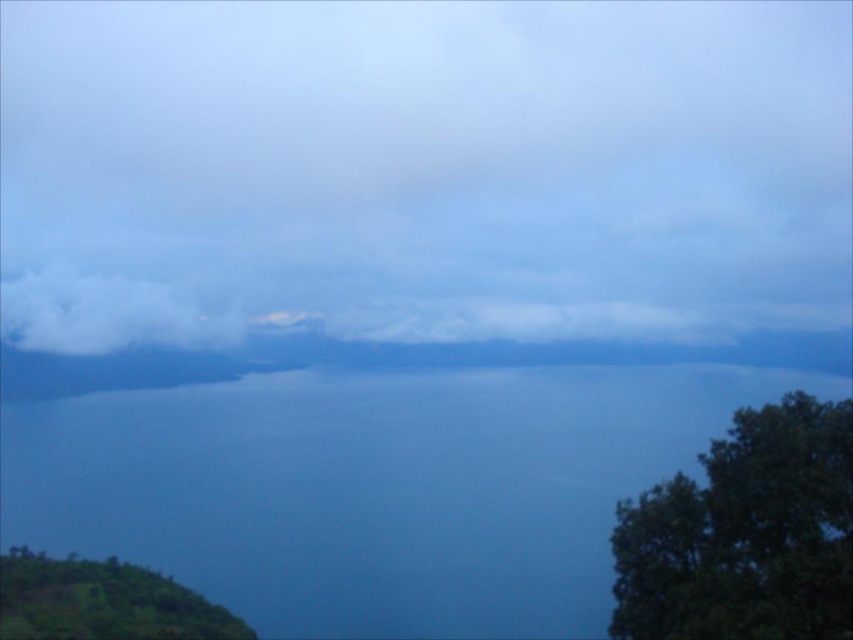
You are standing on the shore of the lake and looking at the green leafy hillside at lower left and the white fluffy cloud at left. Which object appears larger in the scene?

The green leafy hillside at lower left appears larger than the white fluffy cloud at left in the scene.

You are standing at the edge of the green leafy hillside at lower left and want to cross to the blue water at center. Based on the scene description, which direction should you move to reach the water?

You should move towards the center from the green leafy hillside at lower left to reach the blue water at center, as the blue water at center is lower in height compared to the hillside.

Based on the photo, you are planning to place a small wooden bench between the dark green leafy tree at lower right and the green leafy hillside at lower left. Considering their widths, which object will have more space left after placing the bench?

The green leafy hillside at lower left will have more space left after placing the bench because its width is greater than the dark green leafy tree at lower right.